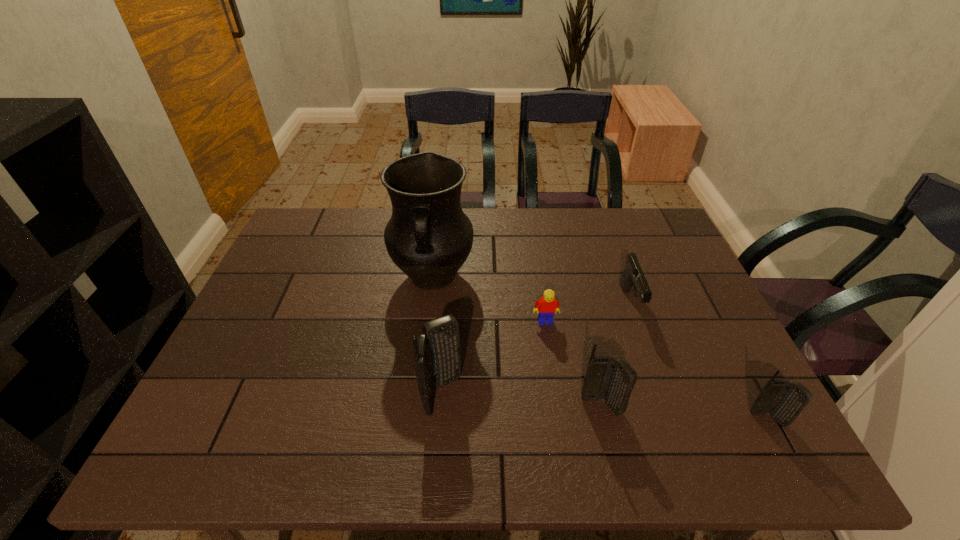
Image resolution: width=960 pixels, height=540 pixels. In order to click on the tallest cellular telephone in this screenshot , I will do pyautogui.click(x=437, y=355).

Find the location of a particular element. the second tallest object is located at coordinates (437, 355).

Find the location of a particular element. This screenshot has height=540, width=960. the second cellular telephone from left to right is located at coordinates (614, 381).

The image size is (960, 540). I want to click on the second tallest cellular telephone, so click(614, 381).

This screenshot has width=960, height=540. I want to click on the third shortest object, so click(x=784, y=400).

Locate an element on the screen. This screenshot has height=540, width=960. the shortest cellular telephone is located at coordinates (784, 400).

Find the location of a particular element. The width and height of the screenshot is (960, 540). the second object from right to left is located at coordinates (633, 277).

The image size is (960, 540). Identify the location of the fourth object from right to left. (547, 305).

Locate an element on the screen. Image resolution: width=960 pixels, height=540 pixels. the tallest object is located at coordinates (429, 237).

Where is `free spot located on the keyboard of the leftmost cellular telephone`? The image size is (960, 540). free spot located on the keyboard of the leftmost cellular telephone is located at coordinates (580, 394).